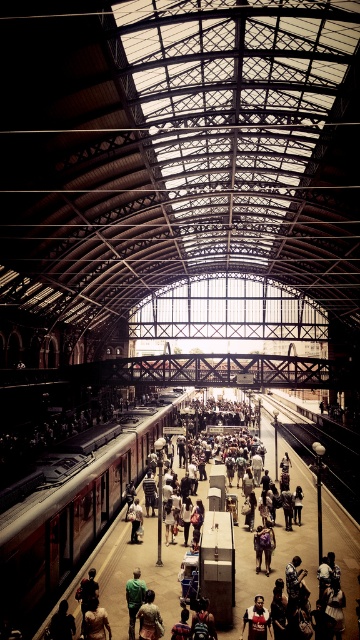
You are standing at the point marked as point (x=72, y=512) in the train station. What object are you currently standing on?

You are standing on the reddish brown metal train at center.